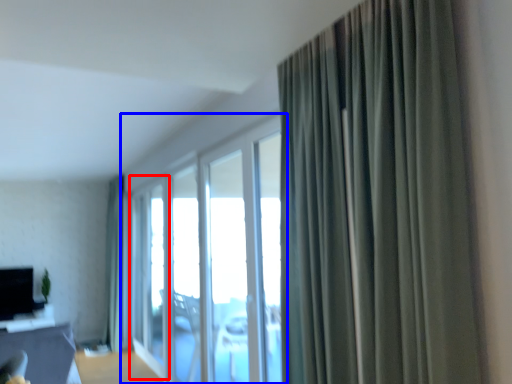
Question: Which object appears closest to the camera in this image, screen door (highlighted by a red box) or window (highlighted by a blue box)?

Choices:
 (A) screen door
 (B) window

Answer: (B)